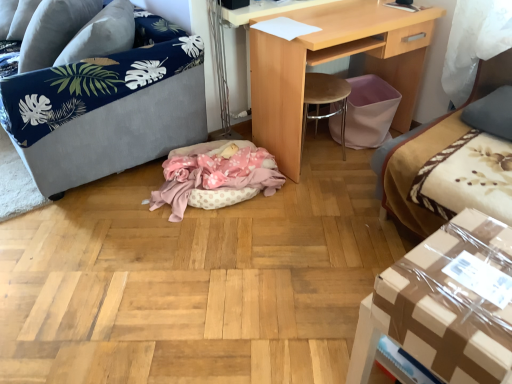
Question: Does velvet grey sofa at left have a larger size compared to light wood desk at center?

Choices:
 (A) no
 (B) yes

Answer: (B)

Question: Is velvet grey sofa at left positioned before light wood desk at center?

Choices:
 (A) no
 (B) yes

Answer: (B)

Question: Is velvet grey sofa at left not inside light wood desk at center?

Choices:
 (A) yes
 (B) no

Answer: (A)

Question: Does velvet grey sofa at left contain light wood desk at center?

Choices:
 (A) no
 (B) yes

Answer: (A)

Question: Can you confirm if velvet grey sofa at left is thinner than light wood desk at center?

Choices:
 (A) no
 (B) yes

Answer: (A)

Question: From the image's perspective, is velvet beige couch at right located above or below velvet grey sofa at left?

Choices:
 (A) above
 (B) below

Answer: (B)

Question: Is point (505, 69) closer or farther from the camera than point (92, 36)?

Choices:
 (A) closer
 (B) farther

Answer: (B)

Question: Is velvet beige couch at right in front of or behind velvet grey sofa at left in the image?

Choices:
 (A) behind
 (B) front

Answer: (B)

Question: Is velvet beige couch at right spatially inside velvet grey sofa at left, or outside of it?

Choices:
 (A) inside
 (B) outside

Answer: (B)

Question: From the image's perspective, is pink polka dot fabric cat bed at center above or below velvet beige couch at right?

Choices:
 (A) above
 (B) below

Answer: (B)

Question: Considering the relative positions of pink polka dot fabric cat bed at center and velvet beige couch at right in the image provided, is pink polka dot fabric cat bed at center to the left or to the right of velvet beige couch at right?

Choices:
 (A) left
 (B) right

Answer: (A)

Question: Considering the positions of pink polka dot fabric cat bed at center and velvet beige couch at right in the image, is pink polka dot fabric cat bed at center wider or thinner than velvet beige couch at right?

Choices:
 (A) wide
 (B) thin

Answer: (B)

Question: Does point (178, 165) appear closer or farther from the camera than point (408, 223)?

Choices:
 (A) farther
 (B) closer

Answer: (A)

Question: In the image, is velvet grey sofa at left positioned in front of or behind gray fabric pillow at upper right, marked as the second pillow in a top-to-bottom arrangement?

Choices:
 (A) front
 (B) behind

Answer: (A)

Question: Is point (46, 79) closer or farther from the camera than point (462, 112)?

Choices:
 (A) closer
 (B) farther

Answer: (A)